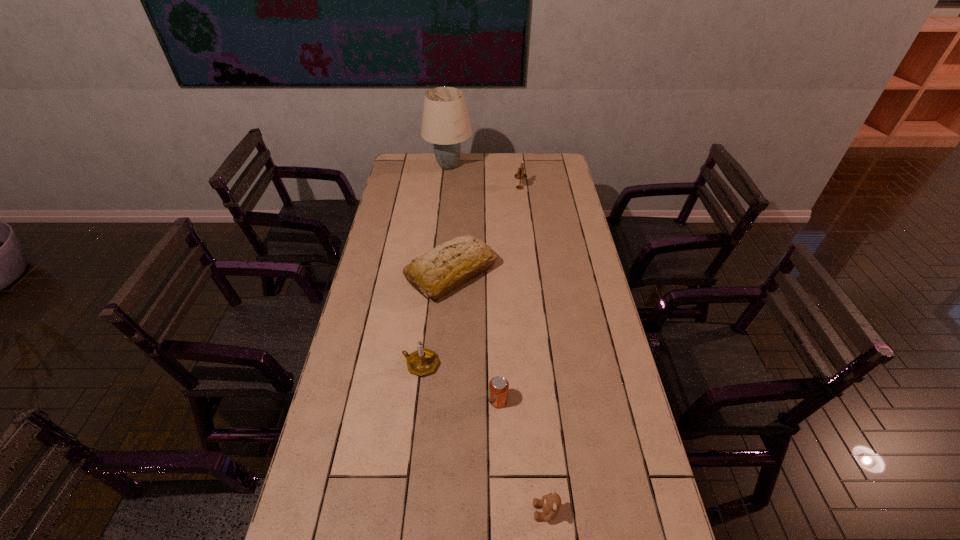
This screenshot has height=540, width=960. In order to click on free spot between the second nearest object and the teddy bear in this screenshot , I will do `click(522, 456)`.

At what (x,y) coordinates should I click in order to perform the action: click on free spot between the farthest object and the right candle holder. Please return your answer as a coordinate pair (x, y). This screenshot has width=960, height=540. Looking at the image, I should click on (484, 177).

Where is `vacant area that lies between the nearer candle holder and the fourth nearest object`? The width and height of the screenshot is (960, 540). vacant area that lies between the nearer candle holder and the fourth nearest object is located at coordinates (436, 319).

The width and height of the screenshot is (960, 540). What are the coordinates of `object that ranks as the second closest to the fourth farthest object` in the screenshot? It's located at (448, 266).

Identify which object is located as the fourth nearest to the teddy bear. Please provide its 2D coordinates. Your answer should be formatted as a tuple, i.e. [(x, y)], where the tuple contains the x and y coordinates of a point satisfying the conditions above.

[(520, 175)]

In order to click on free space that satisfies the following two spatial constraints: 1. on the back side of the bread; 2. on the right side of the fourth farthest object in this screenshot , I will do `click(431, 274)`.

The height and width of the screenshot is (540, 960). In order to click on vacant region that satisfies the following two spatial constraints: 1. on the back side of the bread; 2. on the right side of the right candle holder in this screenshot , I will do `click(457, 187)`.